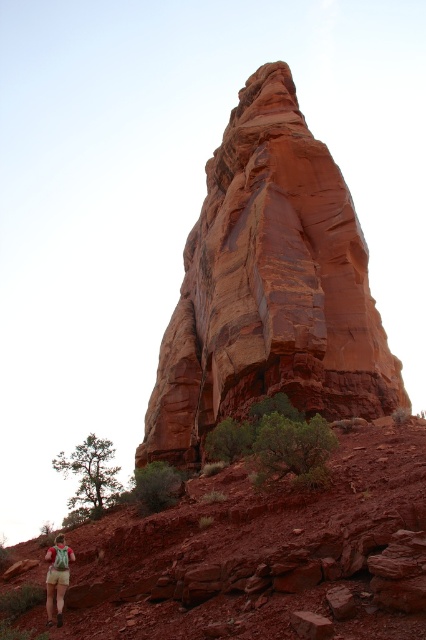
Question: Is rustic sandstone rock formation at center bigger than khaki shorts at lower left?

Choices:
 (A) yes
 (B) no

Answer: (A)

Question: Observing the image, what is the correct spatial positioning of reddish-brown rock at center in reference to khaki shorts at lower left?

Choices:
 (A) right
 (B) left

Answer: (A)

Question: Can you confirm if rustic sandstone rock formation at center is wider than reddish-brown rock at center?

Choices:
 (A) yes
 (B) no

Answer: (A)

Question: Which point is closer to the camera?

Choices:
 (A) reddish-brown rock at center
 (B) rustic sandstone rock formation at center

Answer: (A)

Question: Which object is the closest to the rustic sandstone rock formation at center?

Choices:
 (A) reddish-brown rock at center
 (B) khaki shorts at lower left

Answer: (A)

Question: Among these points, which one is nearest to the camera?

Choices:
 (A) (170, 577)
 (B) (161, 460)
 (C) (62, 580)

Answer: (A)